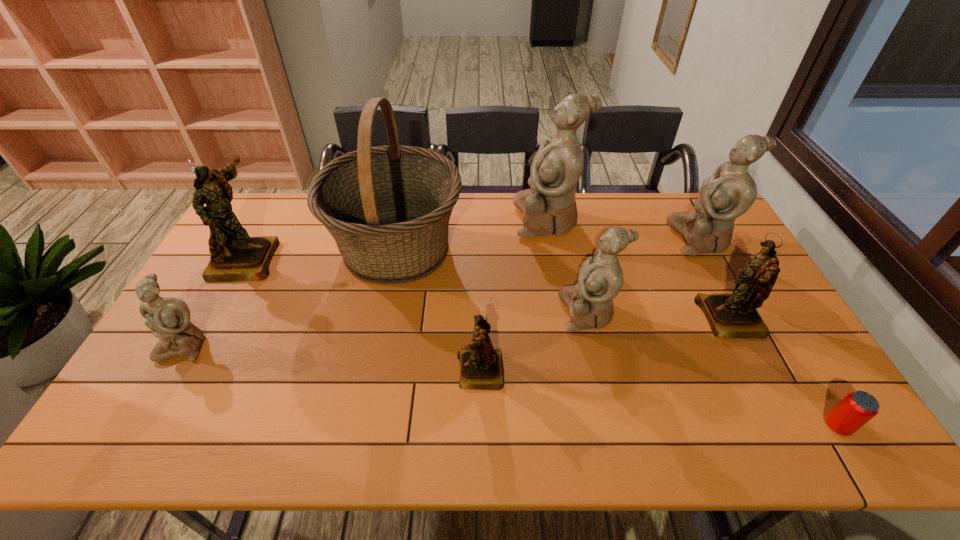
Where is `free space located 0.110m on the front-facing side of the nearest gold figurine`? free space located 0.110m on the front-facing side of the nearest gold figurine is located at coordinates (414, 372).

Image resolution: width=960 pixels, height=540 pixels. Find the location of `free space located 0.200m on the back of the shortest object`. free space located 0.200m on the back of the shortest object is located at coordinates (788, 346).

This screenshot has width=960, height=540. In order to click on basket located in the far edge section of the desktop in this screenshot , I will do `click(388, 208)`.

The width and height of the screenshot is (960, 540). I want to click on object situated at the near edge, so click(857, 408).

Identify the location of can located in the right edge section of the desktop. This screenshot has height=540, width=960. (857, 408).

I want to click on object positioned at the far right corner, so click(x=730, y=191).

This screenshot has height=540, width=960. I want to click on object present at the near right corner, so click(x=857, y=408).

What are the coordinates of `vacant space at the near edge of the desktop` in the screenshot? It's located at (223, 435).

Locate an element on the screen. Image resolution: width=960 pixels, height=540 pixels. vacant region at the left edge is located at coordinates (232, 296).

Where is `vacant point located between the rightmost gold figurine and the second smallest white figurine`? This screenshot has height=540, width=960. vacant point located between the rightmost gold figurine and the second smallest white figurine is located at coordinates (660, 315).